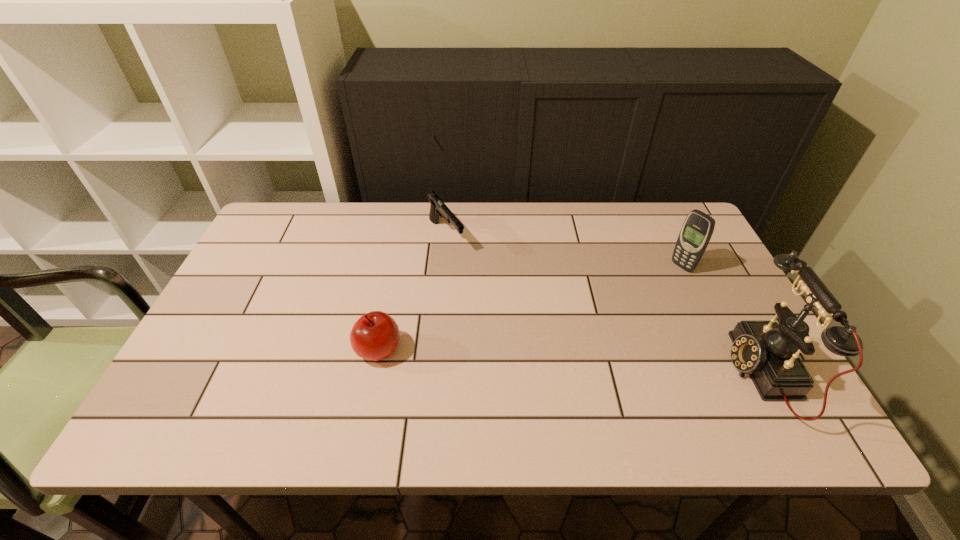
The height and width of the screenshot is (540, 960). Identify the location of free space located on the screen of the third shortest object. (588, 325).

The image size is (960, 540). Identify the location of free region located on the screen of the third shortest object. (597, 320).

The image size is (960, 540). I want to click on blank space located on the screen of the third shortest object, so click(x=633, y=298).

Find the location of a particular element. The height and width of the screenshot is (540, 960). free spot located at the aiming end of the third object from right to left is located at coordinates (464, 266).

You are a GUI agent. You are given a task and a screenshot of the screen. Output one action in this format:
    pyautogui.click(x=<x>, y=<y>)
    Task: Click on the vacant space located at the aiming end of the third object from right to left
    
    Given the screenshot: What is the action you would take?
    pyautogui.click(x=474, y=279)

In order to click on free space located at the aiming end of the third object from right to left in this screenshot , I will do `click(491, 299)`.

What are the coordinates of `object that is at the far edge` in the screenshot? It's located at click(438, 208).

Identify the location of apple situated at the near edge. (375, 336).

Find the location of a particular element. Image resolution: width=960 pixels, height=540 pixels. telephone located in the near edge section of the desktop is located at coordinates (768, 351).

I want to click on telephone present at the right edge, so click(768, 351).